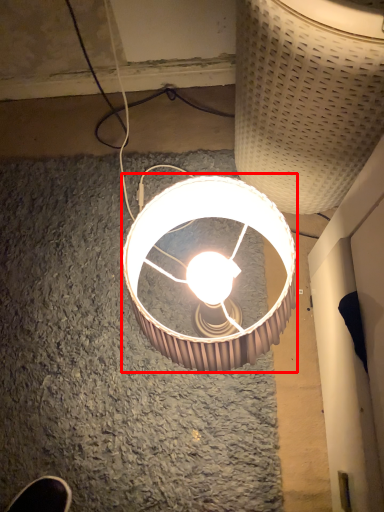
Question: Observing the image, what is the correct spatial positioning of lamp (annotated by the red box) in reference to lamp?

Choices:
 (A) left
 (B) right

Answer: (A)